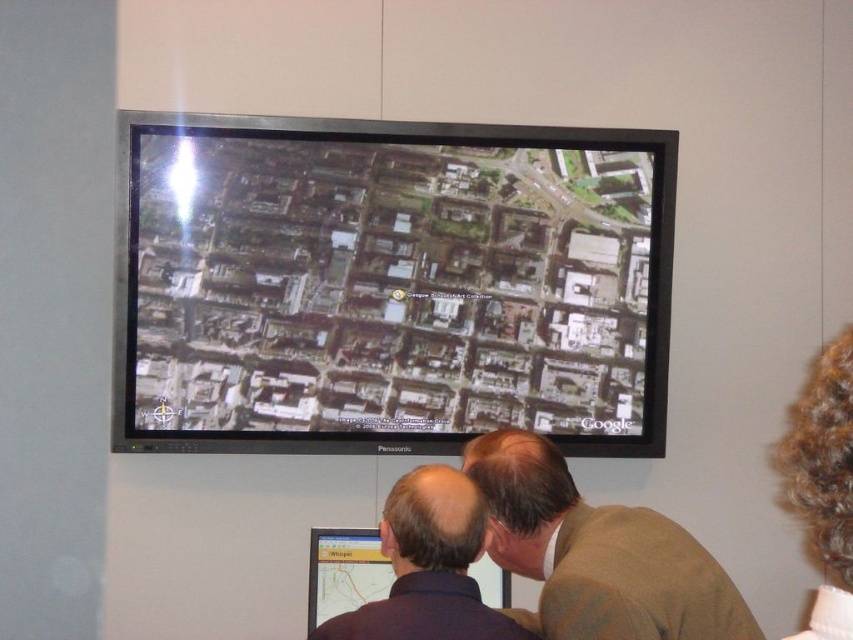
You are standing in front of the large screen and notice the brown wool sweater at lower right and the dark blue shirt at lower center. Which clothing item is positioned further to the right side of the scene?

The brown wool sweater at lower right is positioned further to the right side of the scene than the dark blue shirt at lower center.

You are standing in front of a large screen showing a satellite map of a city. There is also a laptop screen nearby with a yellow bar. The satellite map has a point at coordinates (389,284). If you want to find the same location on the laptop screen, what should you look for?

The point at coordinates (389,284) on the satellite map at center corresponds to the yellow bar on the laptop screen.